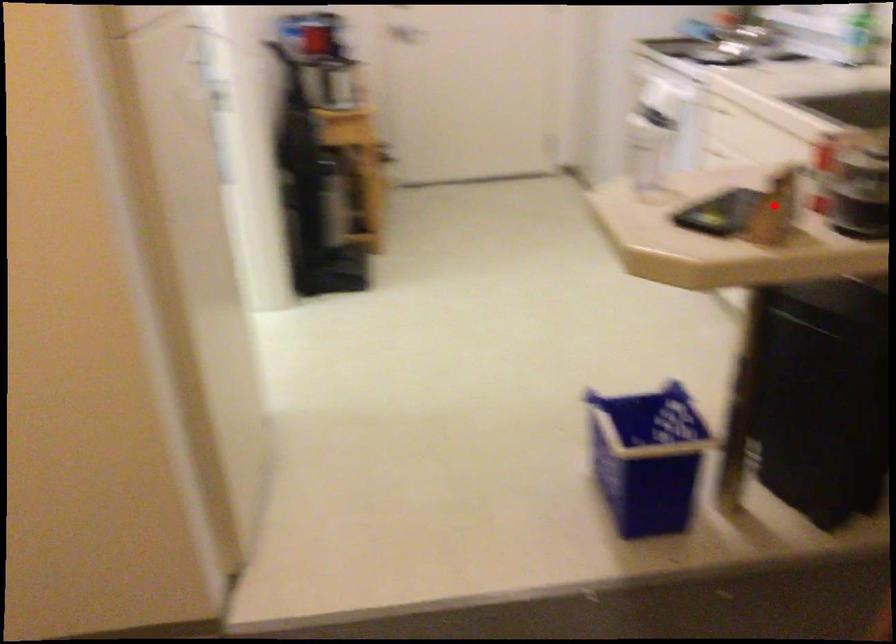
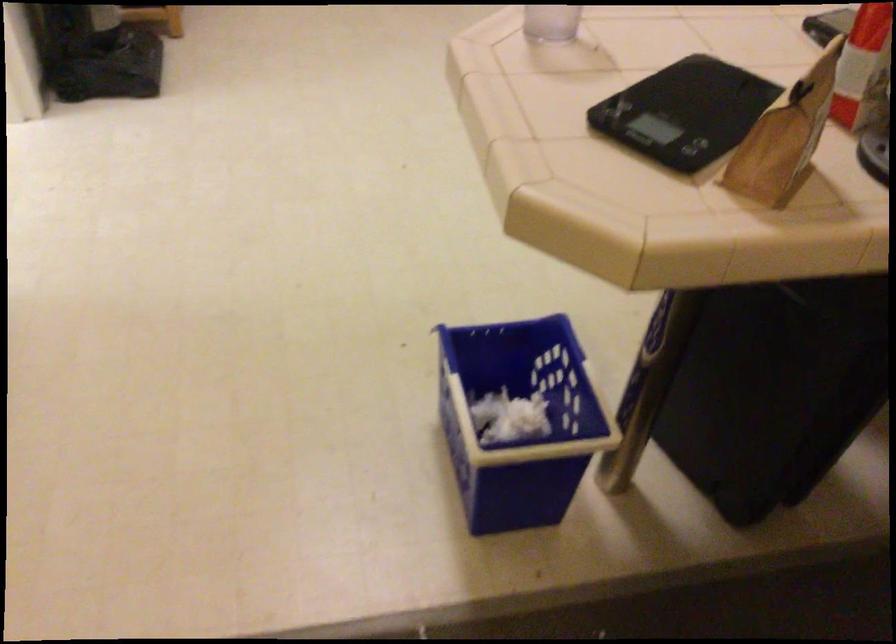
Question: I am providing you with two images of the same scene from different viewpoints. Image1 has a red point marked. In image2, the corresponding 3D location appears at what relative position? Reply with the corresponding letter.

Choices:
 (A) Closer
 (B) Farther

Answer: (A)